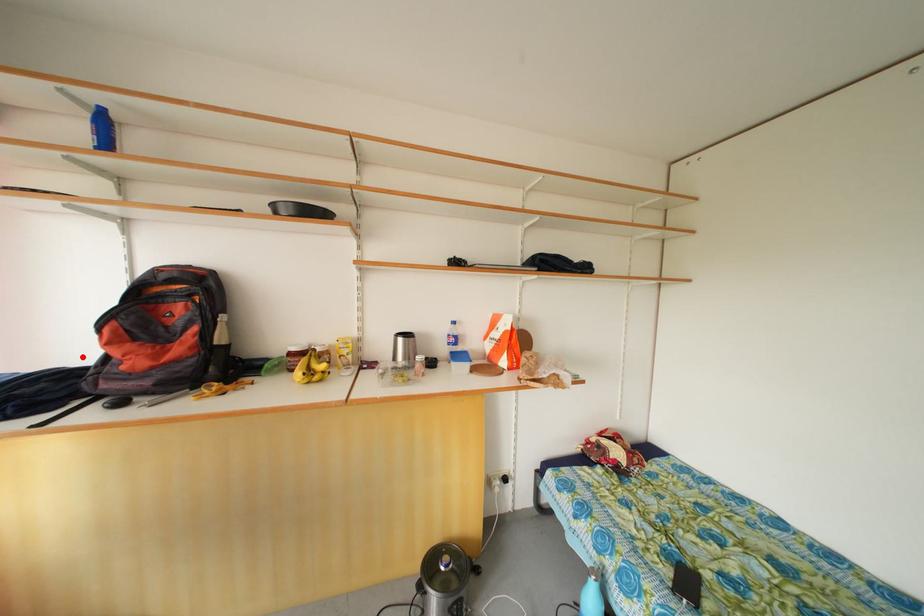
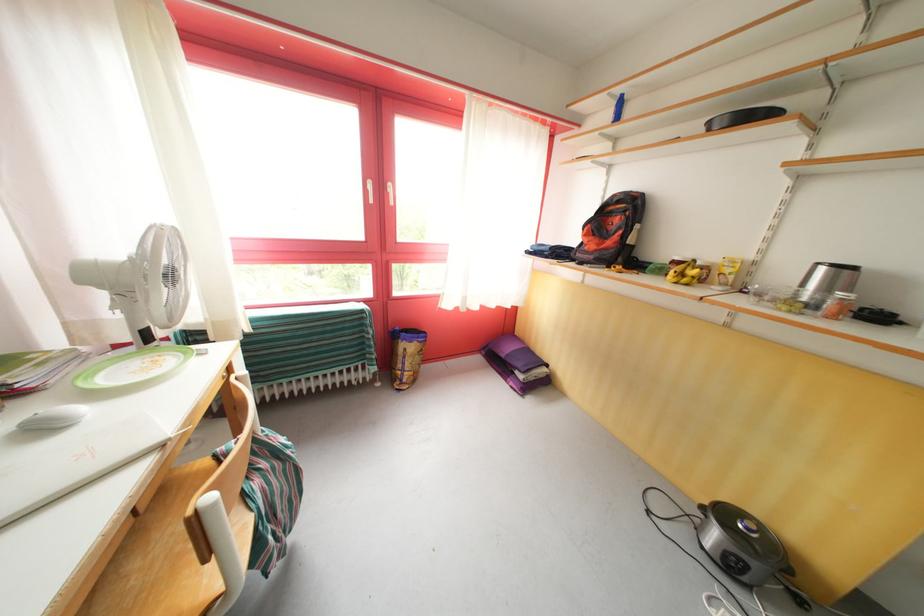
Find the pixel in the second image that matches the highlighted location in the first image.

(580, 245)